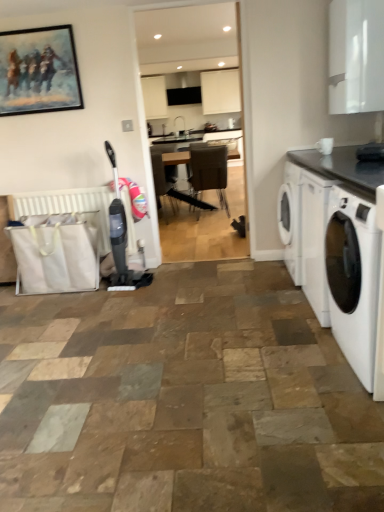
Where is `vacant space situated above oil painting at upper left (from a real-world perspective)`? Image resolution: width=384 pixels, height=512 pixels. vacant space situated above oil painting at upper left (from a real-world perspective) is located at coordinates coord(29,22).